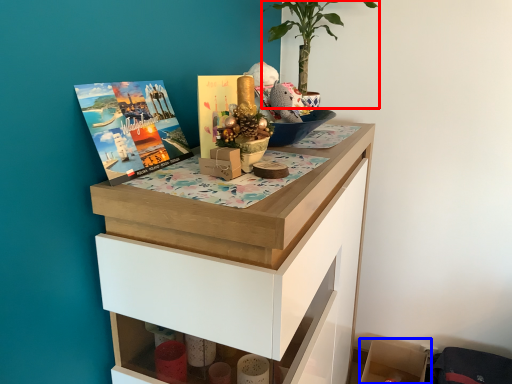
Question: Which of the following is the closest to the observer, houseplant (highlighted by a red box) or shelf (highlighted by a blue box)?

Choices:
 (A) houseplant
 (B) shelf

Answer: (A)